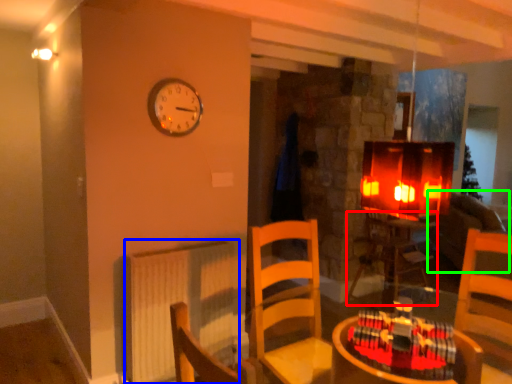
Question: Estimate the real-world distances between objects in this image. Which object is closer to table (highlighted by a red box), radiator (highlighted by a blue box) or couch (highlighted by a green box)?

Choices:
 (A) radiator
 (B) couch

Answer: (B)